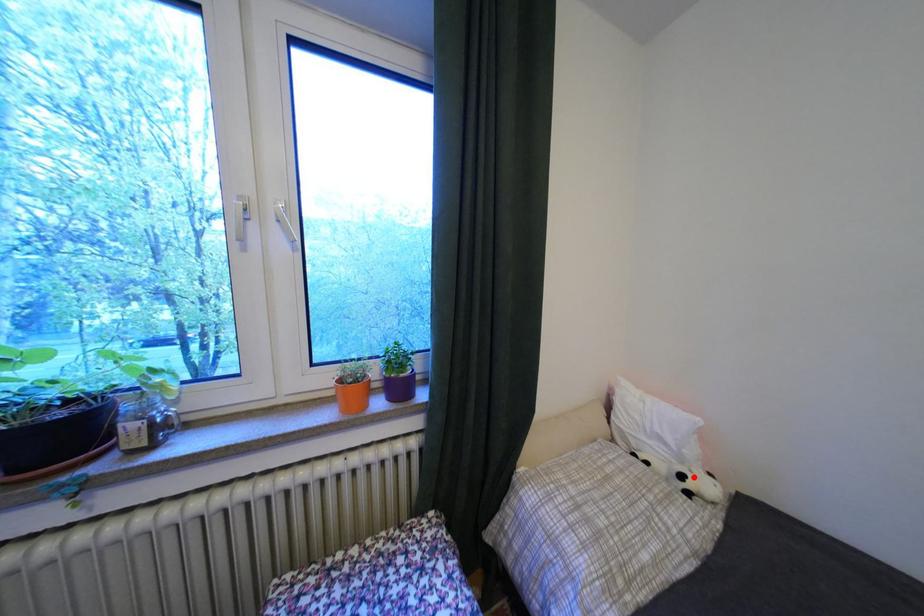
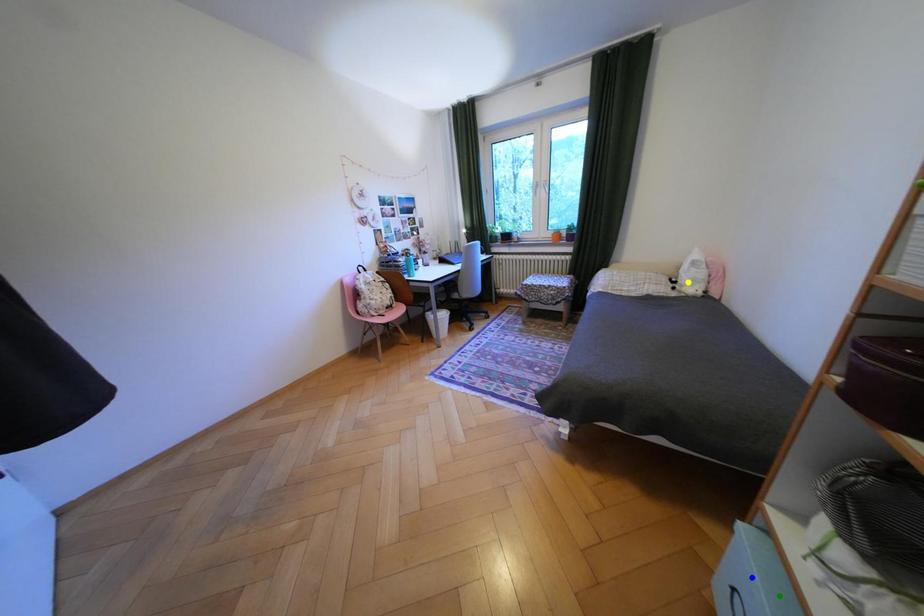
Question: I am providing you with two images of the same scene from different viewpoints. A red point is marked on the first image. You are given multiple points on the second image. Which spot in image 2 lines up with the point in image 1?

Choices:
 (A) blue point
 (B) yellow point
 (C) green point

Answer: (B)